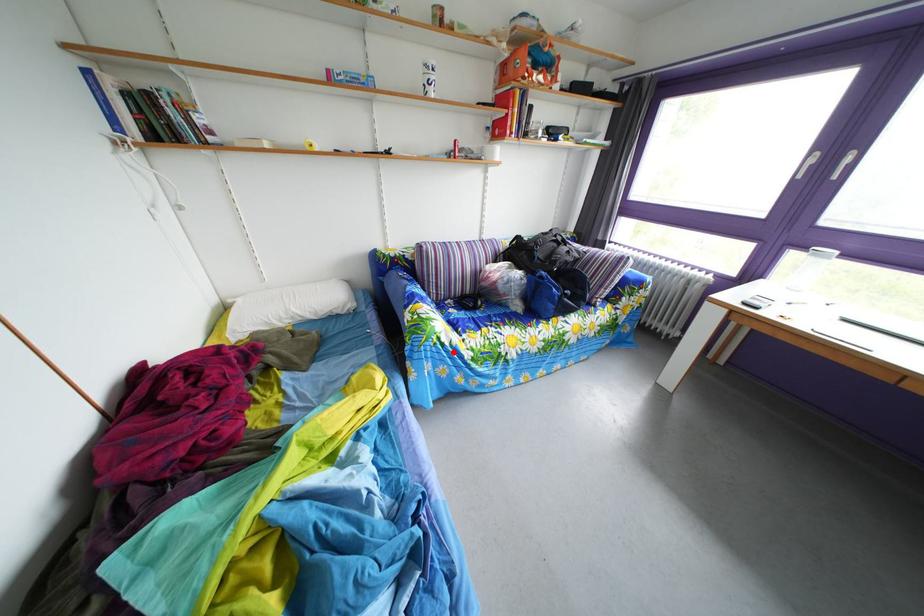
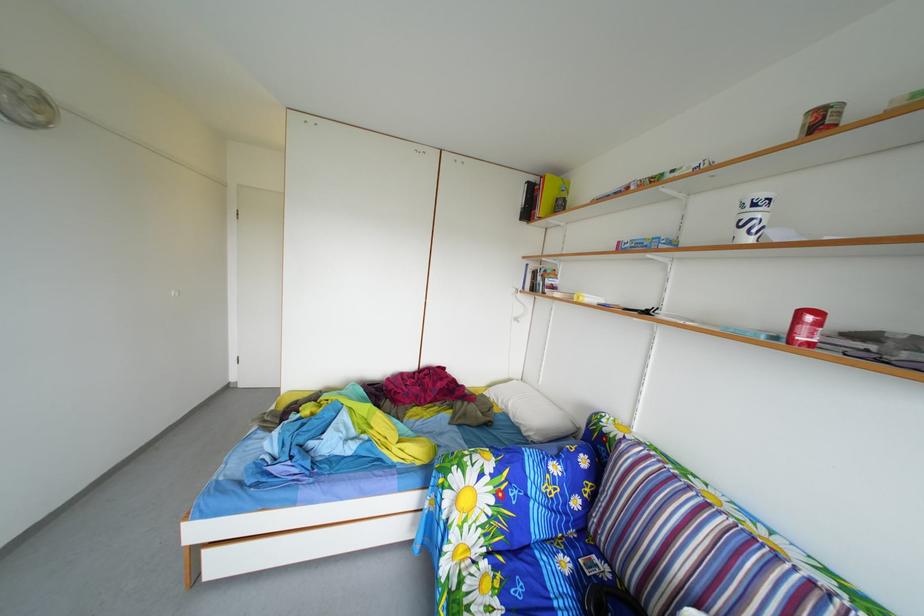
In the second image, find the point that corresponds to the highlighted location in the first image.

(453, 507)